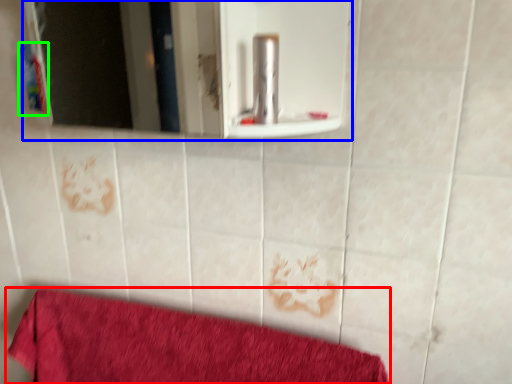
Question: Which object is positioned farthest from towel (highlighted by a red box)? Select from mirror (highlighted by a blue box) and toiletry (highlighted by a green box).

Choices:
 (A) mirror
 (B) toiletry

Answer: (A)